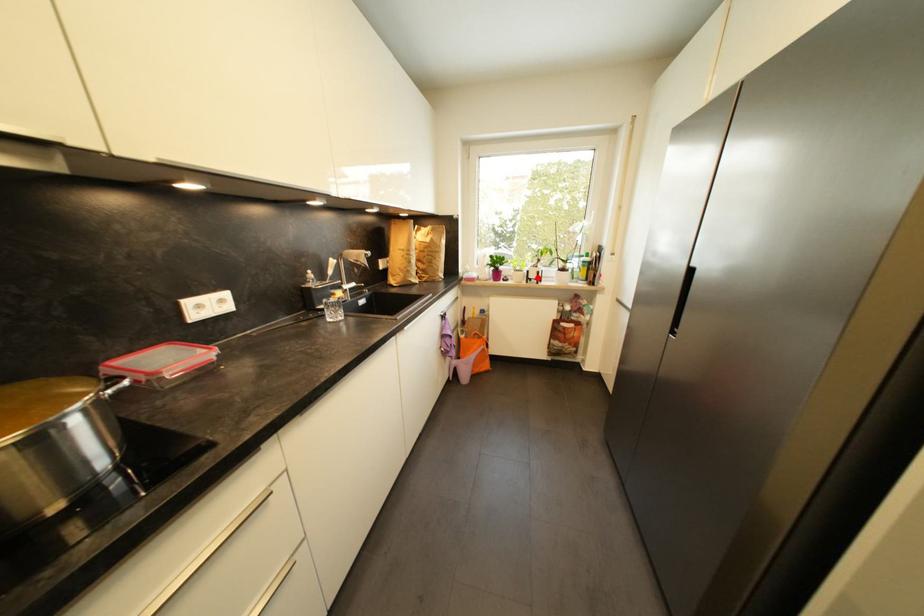
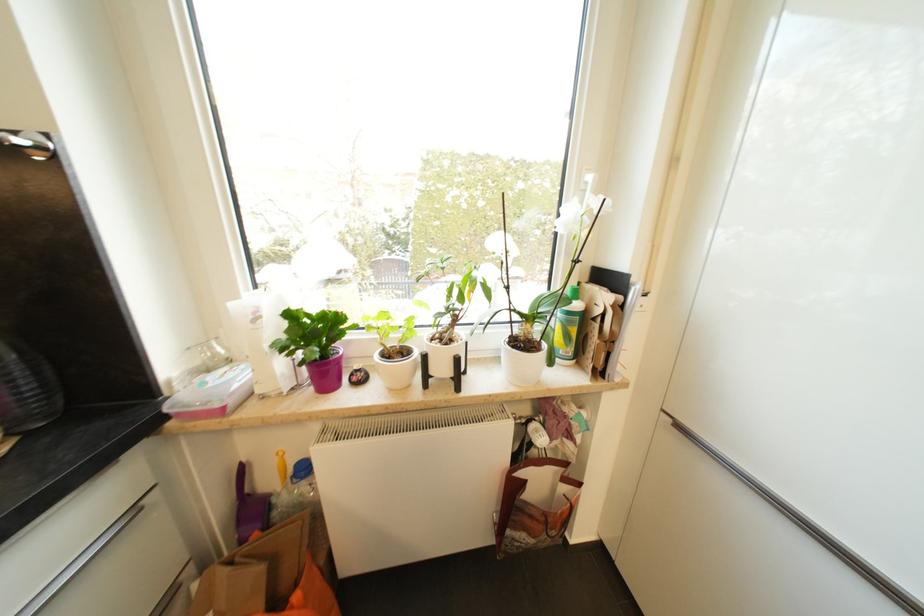
Question: A red point is marked in image1. In image2, is the corresponding 3D point closer to the camera or farther? Reply with the corresponding letter.

Choices:
 (A) The corresponding 3D point is closer.
 (B) The corresponding 3D point is farther.

Answer: (B)